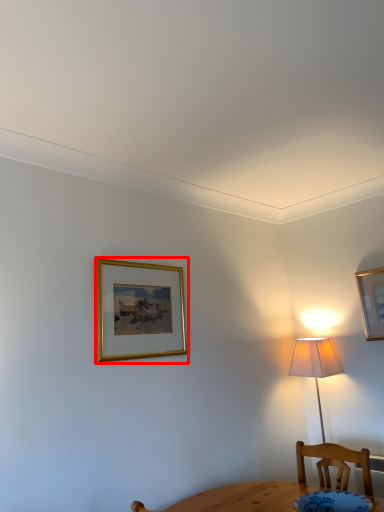
Question: From the image, what is the correct spatial relationship of picture frame (annotated by the red box) in relation to picture frame?

Choices:
 (A) right
 (B) left

Answer: (B)